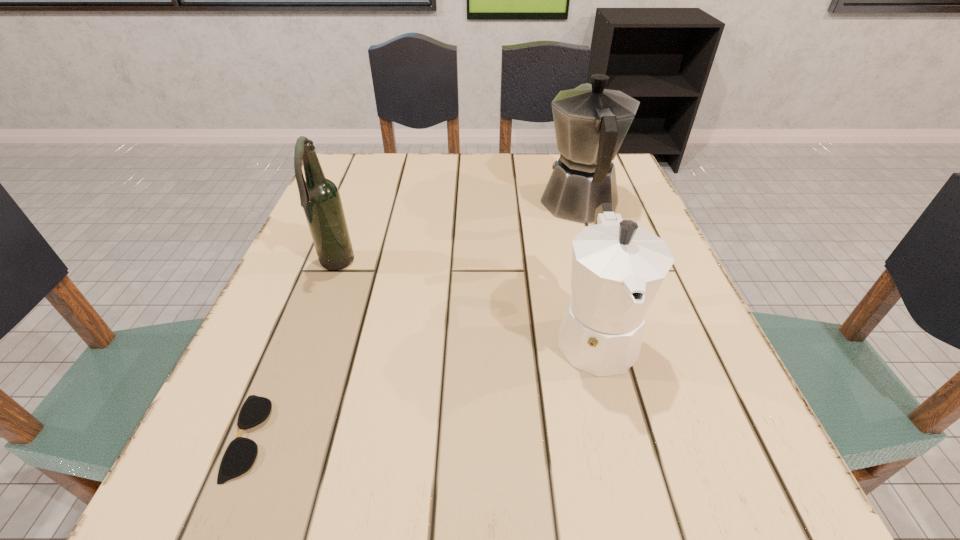
What are the coordinates of `free spot located 0.170m on the front of the third nearest object` in the screenshot? It's located at (304, 352).

Where is `vacant space situated 0.110m at the spout of the second nearest object`? This screenshot has width=960, height=540. vacant space situated 0.110m at the spout of the second nearest object is located at coordinates (628, 464).

At what (x,y) coordinates should I click in order to perform the action: click on vacant region located on the back of the nearest object. Please return your answer as a coordinate pair (x, y). Looking at the image, I should click on click(x=320, y=266).

You are a GUI agent. You are given a task and a screenshot of the screen. Output one action in this format:
    pyautogui.click(x=<x>, y=<y>)
    Task: Click on the object that is at the far edge
    
    Given the screenshot: What is the action you would take?
    pyautogui.click(x=591, y=122)

Image resolution: width=960 pixels, height=540 pixels. Identify the location of object that is positioned at the near edge. (240, 455).

This screenshot has height=540, width=960. Find the location of `beer bottle at the left edge`. beer bottle at the left edge is located at coordinates (320, 198).

Find the location of a particular element. The height and width of the screenshot is (540, 960). spectacles that is at the left edge is located at coordinates (240, 455).

You are a GUI agent. You are given a task and a screenshot of the screen. Output one action in this format:
    pyautogui.click(x=<x>, y=<y>)
    Task: Click on the object located at the near left corner
    The width and height of the screenshot is (960, 540).
    Given the screenshot: What is the action you would take?
    pyautogui.click(x=240, y=455)

Where is `object that is positioned at the far right corner`? Image resolution: width=960 pixels, height=540 pixels. object that is positioned at the far right corner is located at coordinates (591, 122).

In the image, there is a desktop. Identify the location of vacant area at the far edge. tap(427, 192).